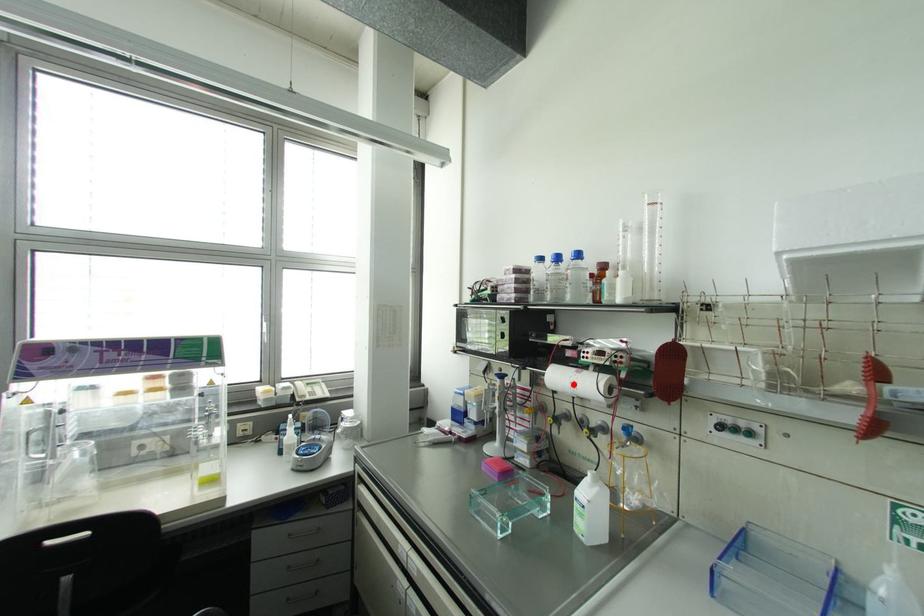
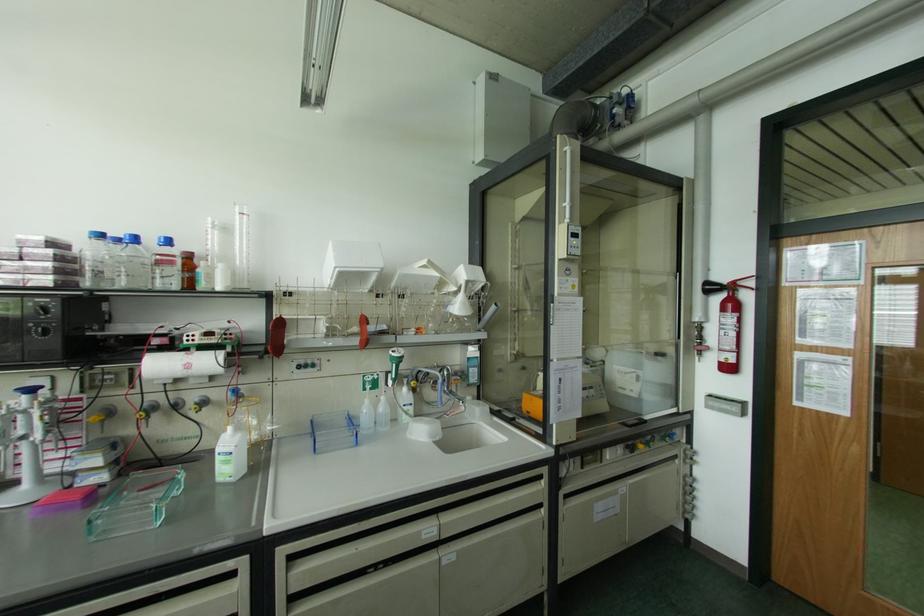
In the second image, find the point that corresponds to the highlighted location in the first image.

(188, 366)